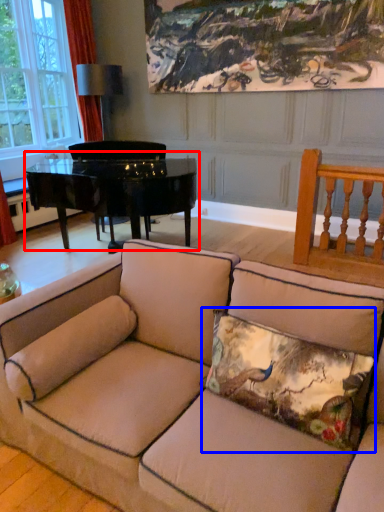
Question: Which point is closer to the camera, table (highlighted by a red box) or pillow (highlighted by a blue box)?

Choices:
 (A) table
 (B) pillow

Answer: (B)